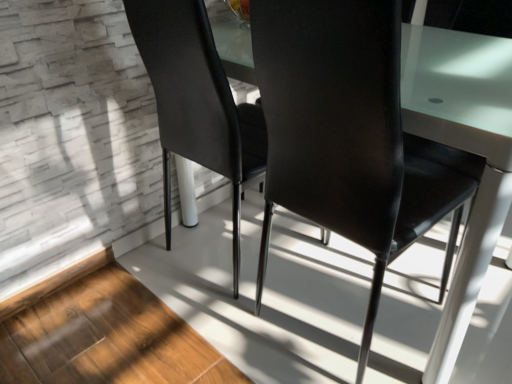
Question: In terms of size, does matte black chair at center, arranged as the second chair when viewed from the right, appear bigger or smaller than matte black chair at center, arranged as the second chair when viewed from the left?

Choices:
 (A) big
 (B) small

Answer: (B)

Question: Looking at their shapes, would you say matte black chair at center, arranged as the second chair when viewed from the right, is wider or thinner than matte black chair at center, the 1th chair in the right-to-left sequence?

Choices:
 (A) wide
 (B) thin

Answer: (B)

Question: Is matte black chair at center, the 1th chair in the left-to-right sequence, spatially inside matte black chair at center, arranged as the second chair when viewed from the left, or outside of it?

Choices:
 (A) outside
 (B) inside

Answer: (A)

Question: Considering the positions of matte black chair at center, arranged as the second chair when viewed from the left, and matte black chair at center, the 1th chair in the left-to-right sequence, in the image, is matte black chair at center, arranged as the second chair when viewed from the left, taller or shorter than matte black chair at center, the 1th chair in the left-to-right sequence,?

Choices:
 (A) tall
 (B) short

Answer: (A)

Question: In terms of size, does matte black chair at center, the 1th chair in the right-to-left sequence, appear bigger or smaller than matte black chair at center, the 1th chair in the left-to-right sequence?

Choices:
 (A) small
 (B) big

Answer: (B)

Question: Does point (305, 122) appear closer or farther from the camera than point (224, 107)?

Choices:
 (A) farther
 (B) closer

Answer: (B)

Question: Is matte black chair at center, arranged as the second chair when viewed from the left, to the left or to the right of matte black chair at center, arranged as the second chair when viewed from the right, in the image?

Choices:
 (A) left
 (B) right

Answer: (B)